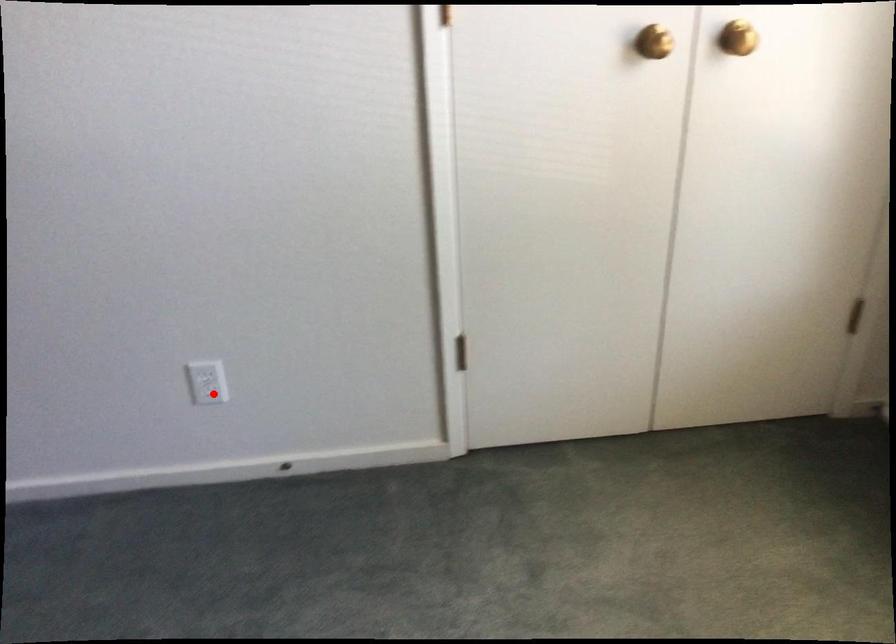
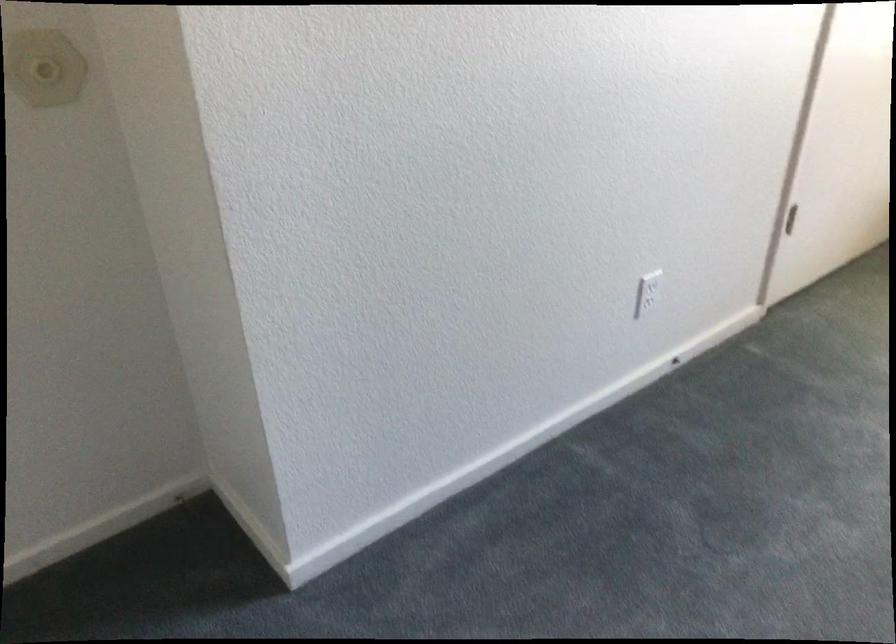
Find the pixel in the second image that matches the highlighted location in the first image.

(645, 303)